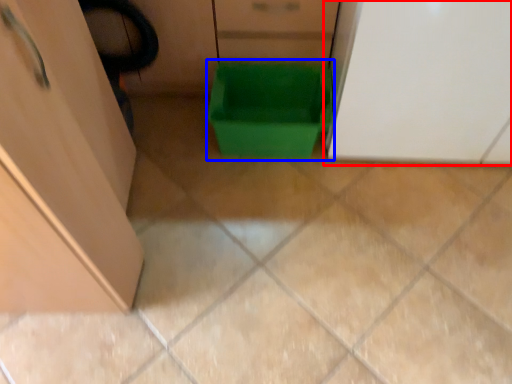
Question: Which of the following is the farthest to the observer, cabinetry (highlighted by a red box) or storage box (highlighted by a blue box)?

Choices:
 (A) cabinetry
 (B) storage box

Answer: (B)